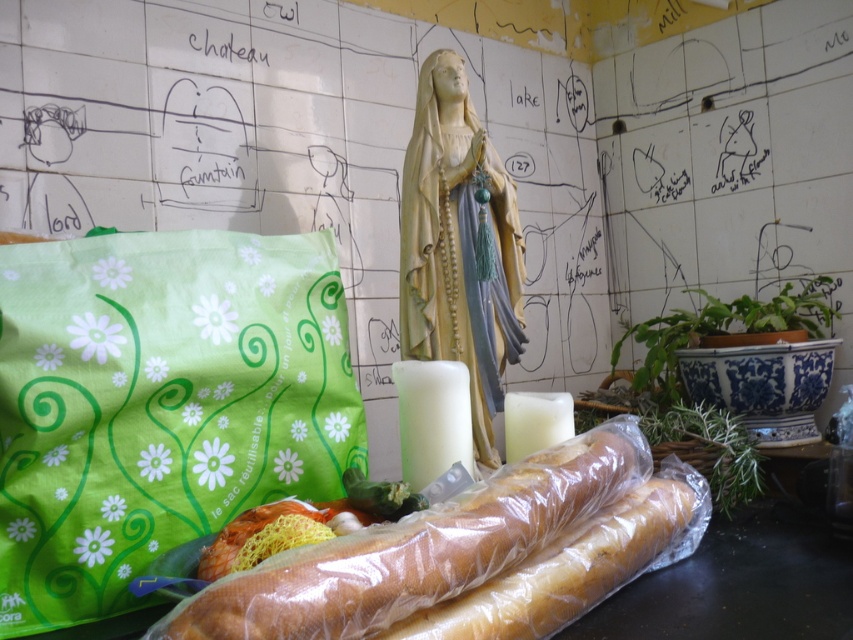
You are a baker who needs to place both the translucent plastic baguette at center and the golden brown baguette at center on a shelf. The shelf has a minimum spacing requirement of 2 inches between items. Can you place them on the same shelf without violating the spacing rule?

The translucent plastic baguette at center is 2.30 inches from golden brown baguette at center, which exceeds the required 2 inches spacing. Therefore, they can be placed on the same shelf without violating the spacing rule.

You are organizing a picnic basket and need to decide which item to place first. Since the translucent plastic bag at center is larger than the white wax candle at center, which item should you place into the basket first to maximize space efficiency?

The translucent plastic bag at center should be placed first because it is larger, allowing smaller items like the white wax candle at center to be placed around it for better space utilization.